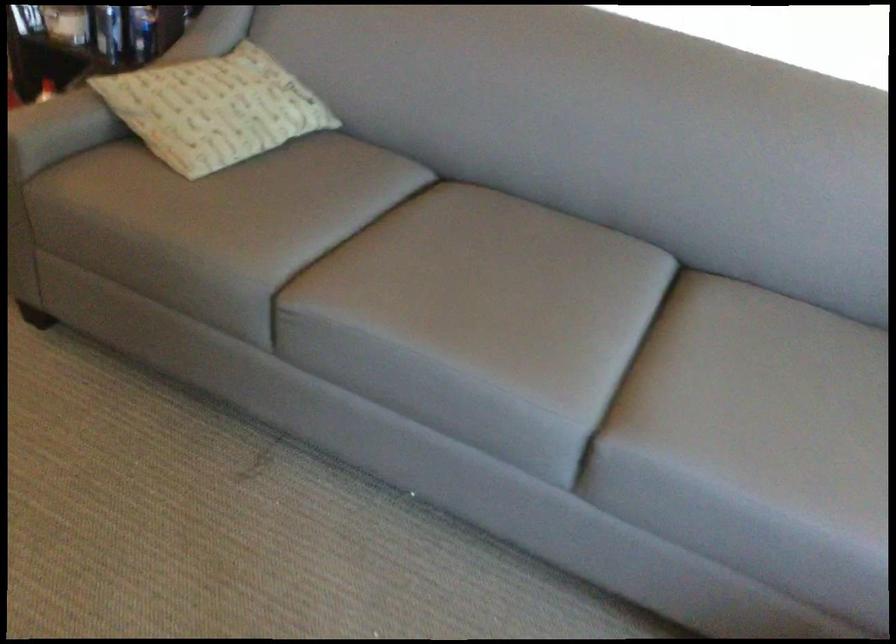
Find where to sit the grey sofa sitting surface. Please return your answer as a coordinate pair (x, y).

(479, 290)